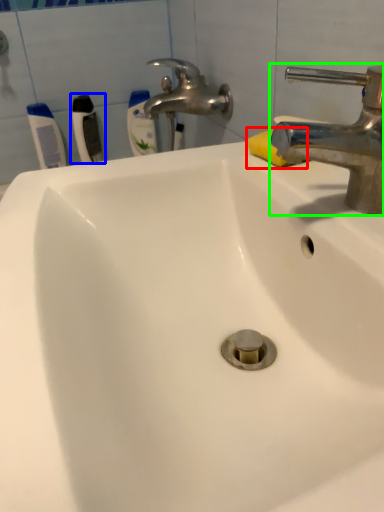
Question: Estimate the real-world distances between objects in this image. Which object is farther from soap (highlighted by a red box), toothbrush (highlighted by a blue box) or tap (highlighted by a green box)?

Choices:
 (A) toothbrush
 (B) tap

Answer: (A)